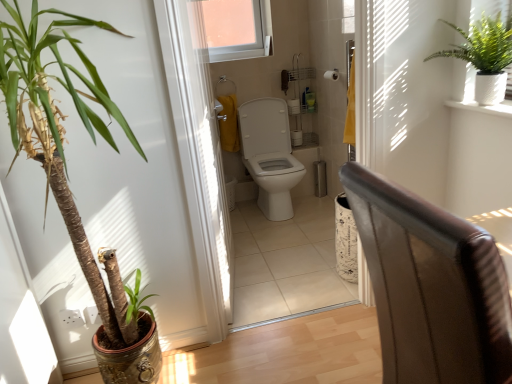
Question: From their relative heights in the image, would you say white plastic screen door at center is taller or shorter than leather armchair at right?

Choices:
 (A) short
 (B) tall

Answer: (B)

Question: In the image, is white plastic screen door at center on the left side or the right side of leather armchair at right?

Choices:
 (A) left
 (B) right

Answer: (A)

Question: Which of these objects is positioned farthest from the white plastic screen door at center?

Choices:
 (A) leather armchair at right
 (B) white matte toilet paper at upper center
 (C) clear glass window at upper center
 (D) white glossy toilet at center
 (E) green leafy plant at left, the first houseplant from the left

Answer: (C)

Question: Based on their relative distances, which object is farther from the leather armchair at right?

Choices:
 (A) green leafy plant at left, the first houseplant from the left
 (B) green textured plant at upper right, the first houseplant positioned from the right
 (C) white matte toilet paper at upper center
 (D) white plastic screen door at center
 (E) clear glass window at upper center

Answer: (E)